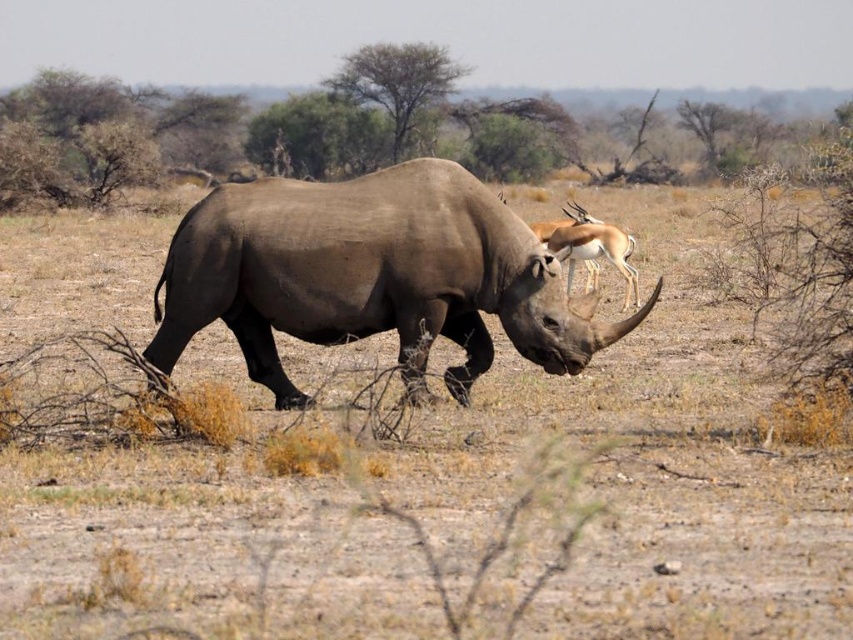
Question: Is gray matte rhinoceros at center smaller than smooth brown antelope at upper right?

Choices:
 (A) no
 (B) yes

Answer: (A)

Question: Is gray matte rhinoceros at center wider than smooth brown antelope at upper right?

Choices:
 (A) no
 (B) yes

Answer: (B)

Question: Which of the following is the farthest from the observer?

Choices:
 (A) (265, 296)
 (B) (610, 257)

Answer: (B)

Question: Is gray matte rhinoceros at center wider than smooth brown antelope at upper right?

Choices:
 (A) yes
 (B) no

Answer: (A)

Question: Which point is closer to the camera?

Choices:
 (A) (569, 259)
 (B) (212, 276)

Answer: (B)